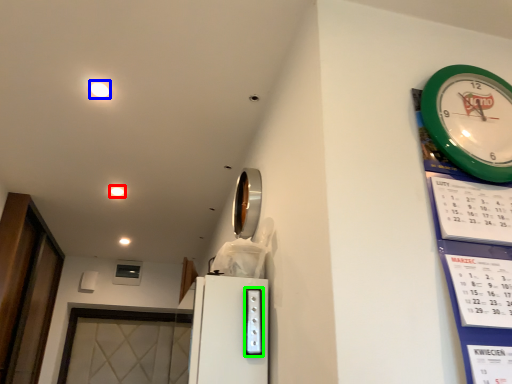
Question: Estimate the real-world distances between objects in this image. Which object is closer to light (highlighted by a red box), light (highlighted by a blue box) or appliance (highlighted by a green box)?

Choices:
 (A) light
 (B) appliance

Answer: (A)